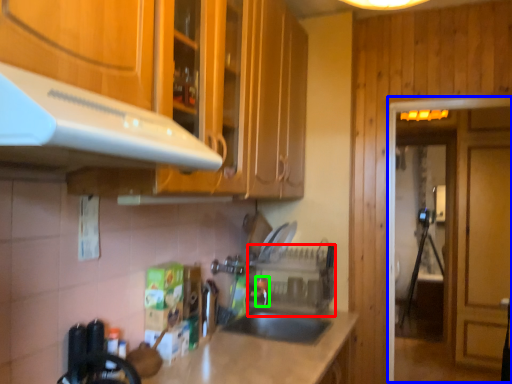
Question: Based on their relative distances, which object is nearer to appliance (highlighted by a red box)? Choose from glass door (highlighted by a blue box) and faucet (highlighted by a green box).

Choices:
 (A) glass door
 (B) faucet

Answer: (B)